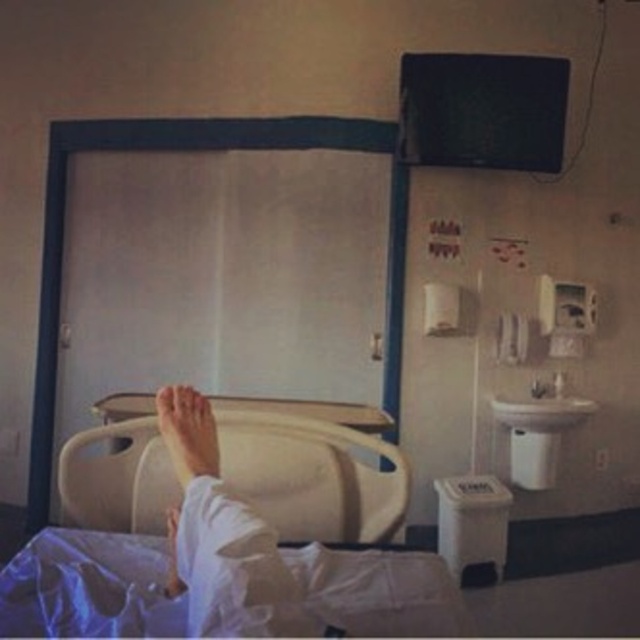
Question: Which point appears farthest from the camera in this image?

Choices:
 (A) (129, 433)
 (B) (170, 534)
 (C) (208, 566)

Answer: (A)

Question: Observing the image, what is the correct spatial positioning of beige plastic hospital bed at lower center in reference to white fabric foot at lower center?

Choices:
 (A) left
 (B) right

Answer: (A)

Question: Based on their relative distances, which object is farther from the light brown skin at center?

Choices:
 (A) beige plastic hospital bed at lower center
 (B) white matte hand at lower center
 (C) white plastic bed at lower center
 (D) white fabric foot at lower center

Answer: (A)

Question: Which point is closer to the camera?

Choices:
 (A) beige plastic hospital bed at lower center
 (B) light brown skin at center
 (C) white fabric foot at lower center
 (D) white plastic bed at lower center

Answer: (C)

Question: Can you confirm if white plastic bed at lower center is positioned below light brown skin at center?

Choices:
 (A) no
 (B) yes

Answer: (B)

Question: In this image, where is light brown skin at center located relative to white matte hand at lower center?

Choices:
 (A) right
 (B) left

Answer: (A)